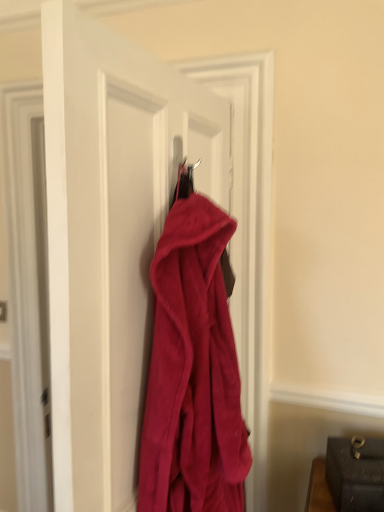
Question: Should I look upward or downward to see fuzzy red coat at center?

Choices:
 (A) up
 (B) down

Answer: (B)

Question: Does velvet red coat at center have a greater height compared to fuzzy red coat at center?

Choices:
 (A) yes
 (B) no

Answer: (A)

Question: Could you tell me if velvet red coat at center is facing fuzzy red coat at center?

Choices:
 (A) no
 (B) yes

Answer: (B)

Question: Does velvet red coat at center have a lesser height compared to fuzzy red coat at center?

Choices:
 (A) no
 (B) yes

Answer: (A)

Question: Does velvet red coat at center have a smaller size compared to fuzzy red coat at center?

Choices:
 (A) no
 (B) yes

Answer: (A)

Question: Can we say velvet red coat at center lies outside fuzzy red coat at center?

Choices:
 (A) yes
 (B) no

Answer: (A)

Question: Can you confirm if velvet red coat at center is positioned to the left of fuzzy red coat at center?

Choices:
 (A) yes
 (B) no

Answer: (A)

Question: From a real-world perspective, does fuzzy red coat at center stand above velvet red coat at center?

Choices:
 (A) yes
 (B) no

Answer: (B)

Question: Is fuzzy red coat at center closer to camera compared to velvet red coat at center?

Choices:
 (A) no
 (B) yes

Answer: (A)

Question: Can you confirm if fuzzy red coat at center is positioned to the left of velvet red coat at center?

Choices:
 (A) yes
 (B) no

Answer: (B)

Question: From the image's perspective, is fuzzy red coat at center located beneath velvet red coat at center?

Choices:
 (A) no
 (B) yes

Answer: (B)

Question: Considering the relative sizes of fuzzy red coat at center and velvet red coat at center in the image provided, is fuzzy red coat at center smaller than velvet red coat at center?

Choices:
 (A) yes
 (B) no

Answer: (A)

Question: Is fuzzy red coat at center not close to velvet red coat at center?

Choices:
 (A) no
 (B) yes

Answer: (A)

Question: From the image's perspective, is velvet red coat at center positioned above or below fuzzy red coat at center?

Choices:
 (A) below
 (B) above

Answer: (B)